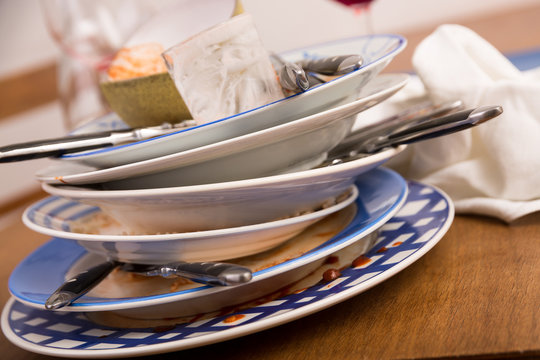
You are a GUI agent. You are given a task and a screenshot of the screen. Output one action in this format:
    pyautogui.click(x=<x>, y=<y>)
    Task: Click on the dishes
    The height and width of the screenshot is (360, 540).
    Given the screenshot: What is the action you would take?
    pyautogui.click(x=364, y=271), pyautogui.click(x=342, y=236), pyautogui.click(x=42, y=218), pyautogui.click(x=145, y=206), pyautogui.click(x=216, y=161), pyautogui.click(x=272, y=112)